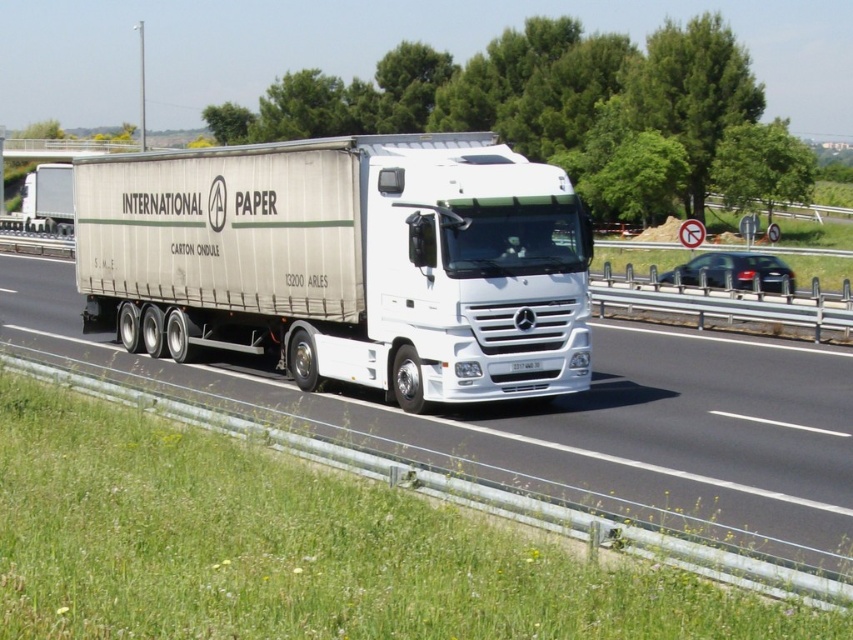
In the scene shown: You are a traffic controller monitoring the highway. You notice two trucks, a white matte trailer truck at center and a white glossy truck at center. Which truck takes up more space on the road?

The white glossy truck at center occupies more space on the road than the white matte trailer truck at center because the white matte trailer truck at center occupies less space than white glossy truck at center.

You are a passenger in the Mercedes truck and want to know which of the two points, point (567, 211) or point (173, 378), is closer to you. Can you determine this?

Point (567, 211) is closer to the viewer than point (173, 378), so the passenger should know that point (567, 211) is closer.

You are a traffic officer observing a highway scene. You notice a white glossy truck at center and a white matte trailer truck at center. Which truck is closer to you?

The white matte trailer truck at center is closer to you because the white glossy truck at center is behind it.